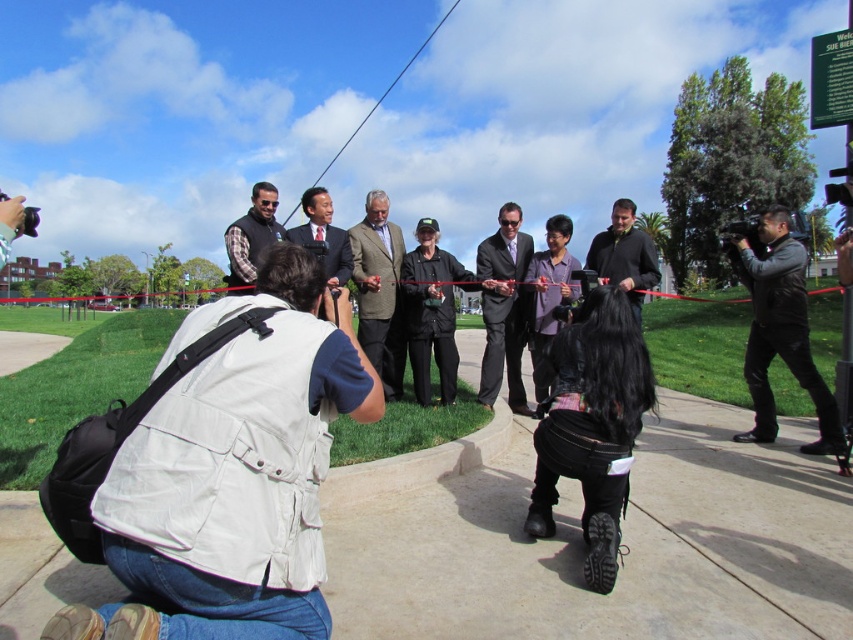
You are a photographer at this event and need to place a small tripod between the concrete at center and the white fabric vest at lower left. Which object has more space available for the tripod?

The white fabric vest at lower left has more space available because the concrete at center occupies less space than it.

You are organizing a photo shoot and need to place a black leather jacket in the scene. According to the image, where should you place the black leather jacket at right?

The black leather jacket at right should be placed at point (780, 330).